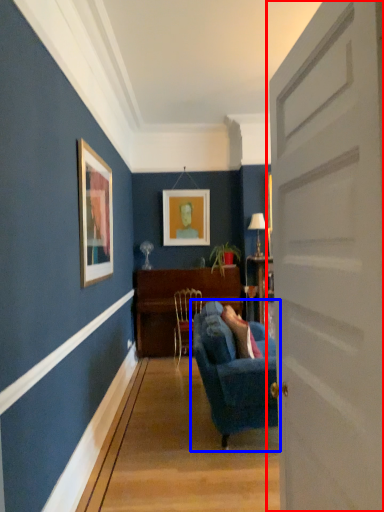
Question: Which object appears closest to the camera in this image, door (highlighted by a red box) or studio couch (highlighted by a blue box)?

Choices:
 (A) door
 (B) studio couch

Answer: (A)